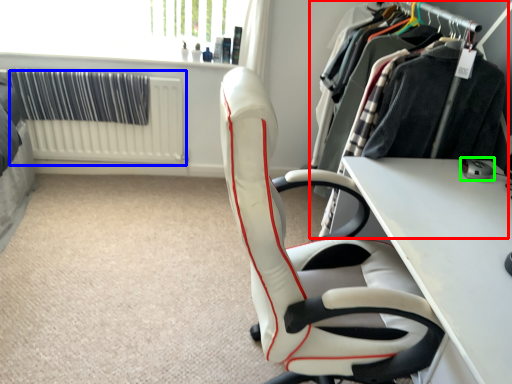
Question: Based on their relative distances, which object is farther from closet (highlighted by a red box)? Choose from radiator (highlighted by a blue box) and equipment (highlighted by a green box).

Choices:
 (A) radiator
 (B) equipment

Answer: (A)